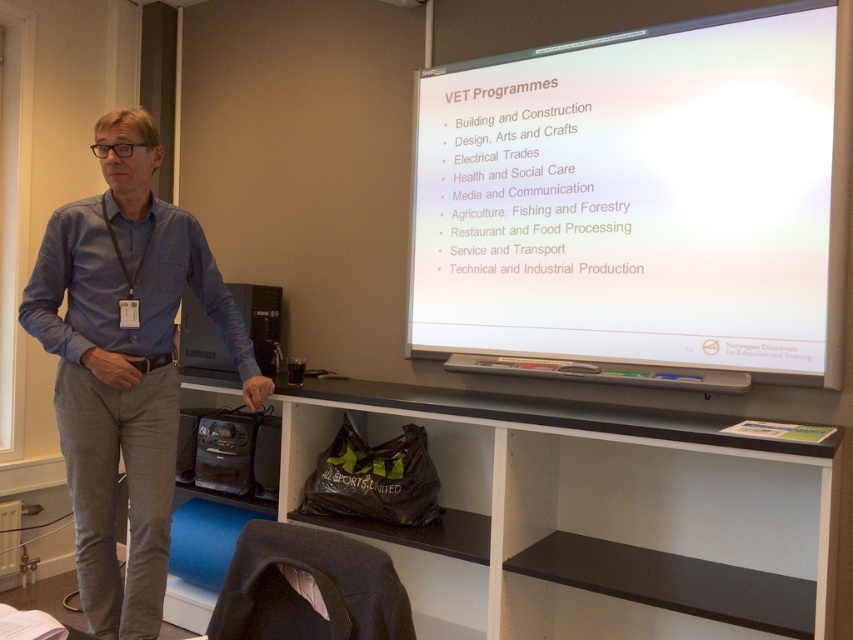
Does point (665, 189) come farther from viewer compared to point (396, 3)?

No, it is not.

In the scene shown: Is white matte projector screen at upper right below white plastic projector at upper center?

Yes, white matte projector screen at upper right is below white plastic projector at upper center.

Who is more distant from viewer, (685, 86) or (390, 1)?

The point (390, 1) is more distant.

The image size is (853, 640). In order to click on white matte projector screen at upper right in this screenshot , I will do `click(640, 204)`.

In the scene shown: Can you confirm if blue cotton shirt at left is bigger than white plastic projector at upper center?

Indeed, blue cotton shirt at left has a larger size compared to white plastic projector at upper center.

Who is more forward, (91, 611) or (395, 0)?

Positioned in front is point (91, 611).

Find the location of `blue cotton shirt at left`. blue cotton shirt at left is located at coordinates (125, 364).

Between point (566, 49) and point (134, 438), which one is positioned in front?

Point (134, 438) is more forward.

Does point (734, 122) come in front of point (38, 266)?

No, it is behind (38, 266).

This screenshot has width=853, height=640. I want to click on white matte projector screen at upper right, so click(x=640, y=204).